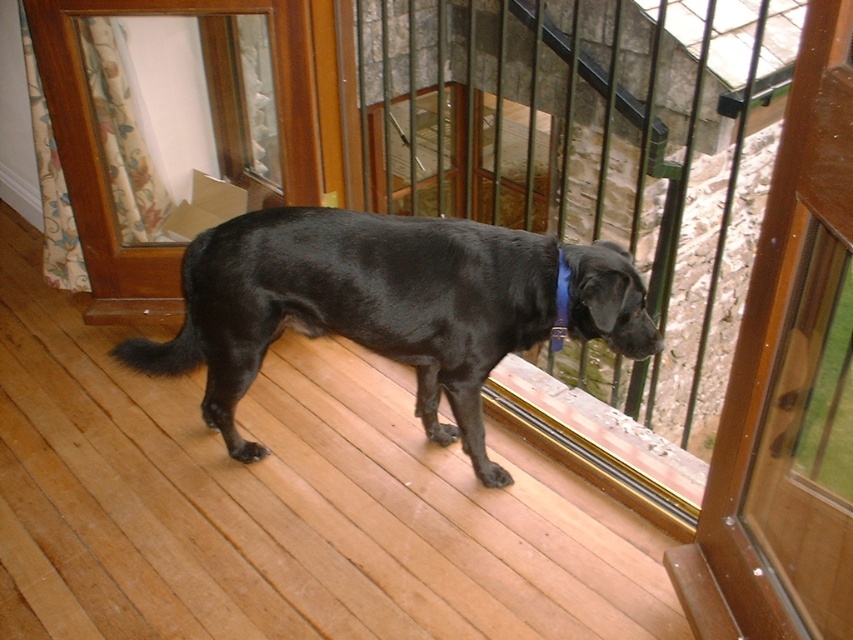
Question: Can you confirm if shiny black dog at center is positioned to the left of blue fabric neckband at center?

Choices:
 (A) yes
 (B) no

Answer: (A)

Question: Which point is closer to the camera taking this photo?

Choices:
 (A) (627, 356)
 (B) (553, 339)

Answer: (B)

Question: Which point is closer to the camera taking this photo?

Choices:
 (A) (567, 308)
 (B) (633, 284)
 (C) (183, 1)

Answer: (B)

Question: From the image, what is the correct spatial relationship of shiny black dog at center in relation to blue fabric neckband at center?

Choices:
 (A) below
 (B) above

Answer: (A)

Question: Among these objects, which one is farthest from the camera?

Choices:
 (A) shiny black dog at center
 (B) transparent glass screen door at lower left
 (C) blue fabric neckband at center

Answer: (B)

Question: Is shiny black dog at center closer to camera compared to blue fabric neckband at center?

Choices:
 (A) yes
 (B) no

Answer: (A)